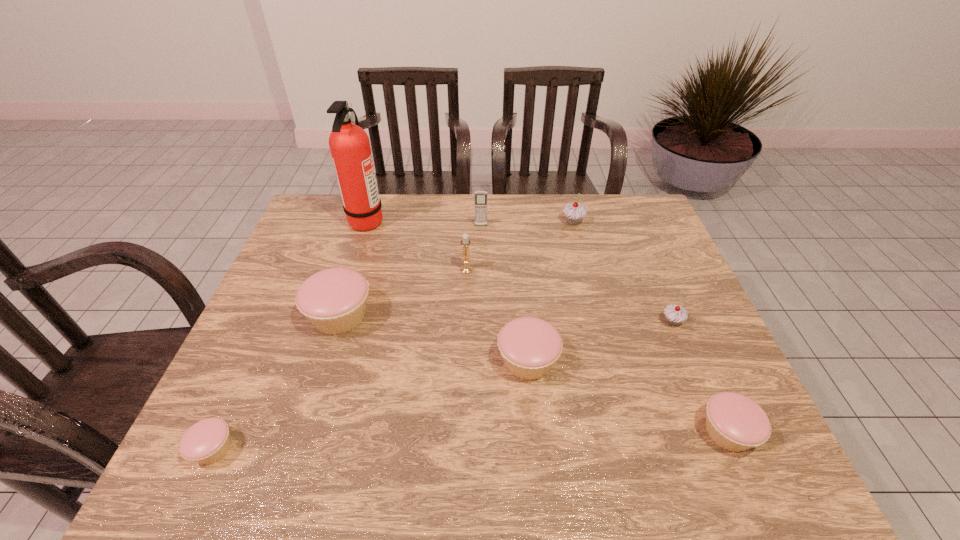
Where is `the second pink cupcake from right to left`? The height and width of the screenshot is (540, 960). the second pink cupcake from right to left is located at coordinates (530, 346).

Find the location of a particular element. The width and height of the screenshot is (960, 540). the fourth cupcake from right to left is located at coordinates (530, 346).

Find the location of `the nearer gray cupcake`. the nearer gray cupcake is located at coordinates (675, 314).

You are a GUI agent. You are given a task and a screenshot of the screen. Output one action in this format:
    pyautogui.click(x=<x>, y=<y>)
    Task: Click on the right gray cupcake
    
    Given the screenshot: What is the action you would take?
    pyautogui.click(x=675, y=314)

I want to click on the rightmost pink cupcake, so click(x=734, y=422).

Find the location of a particular element. The width and height of the screenshot is (960, 540). the eighth tallest object is located at coordinates (734, 422).

The height and width of the screenshot is (540, 960). I want to click on the leftmost pink cupcake, so click(207, 441).

This screenshot has width=960, height=540. In order to click on the shortest cupcake in this screenshot , I will do `click(207, 441)`.

Where is `vacant space located on the handle side of the tallest object`? The width and height of the screenshot is (960, 540). vacant space located on the handle side of the tallest object is located at coordinates click(x=475, y=220).

Locate an element on the screen. blank area located on the front-facing side of the gray cellular telephone is located at coordinates (481, 312).